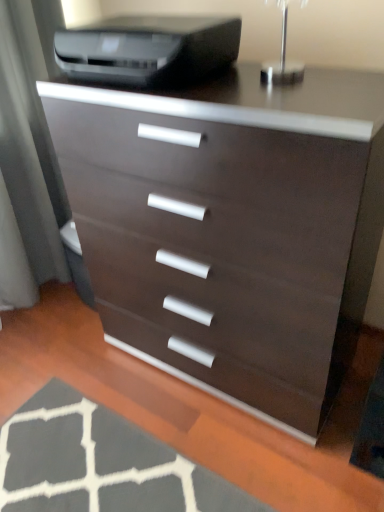
In order to click on vacant space in front of matte gray screen door at left in this screenshot , I will do `click(51, 326)`.